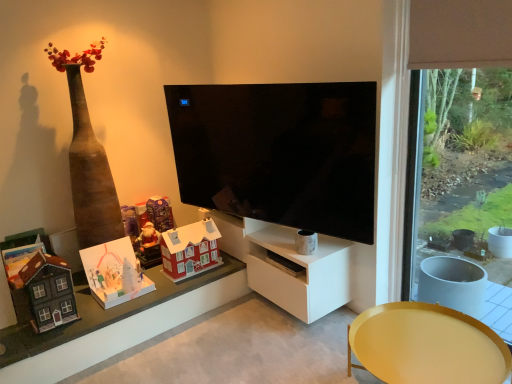
I want to click on free point in front of wooden house at lower left, the 1th toy when ordered from front to back, so click(45, 337).